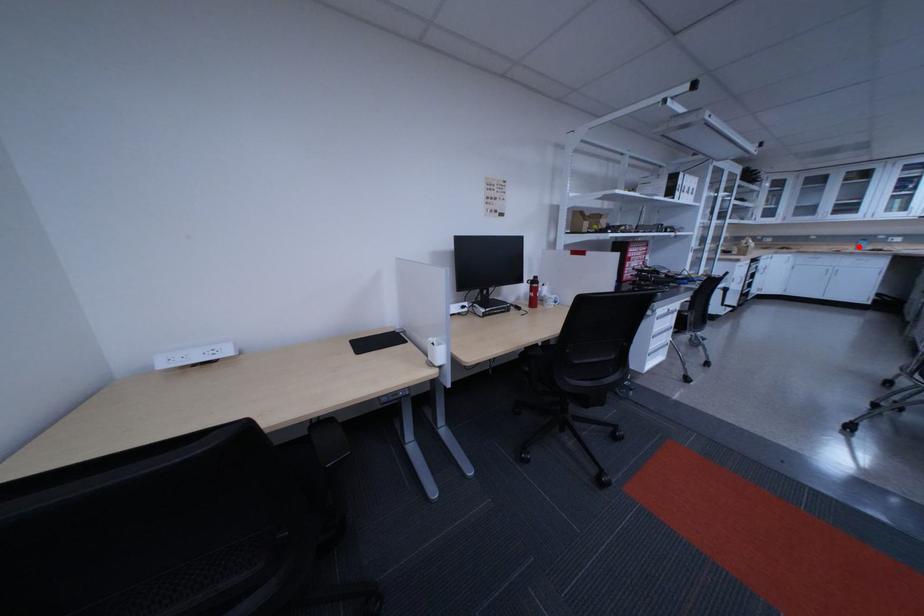
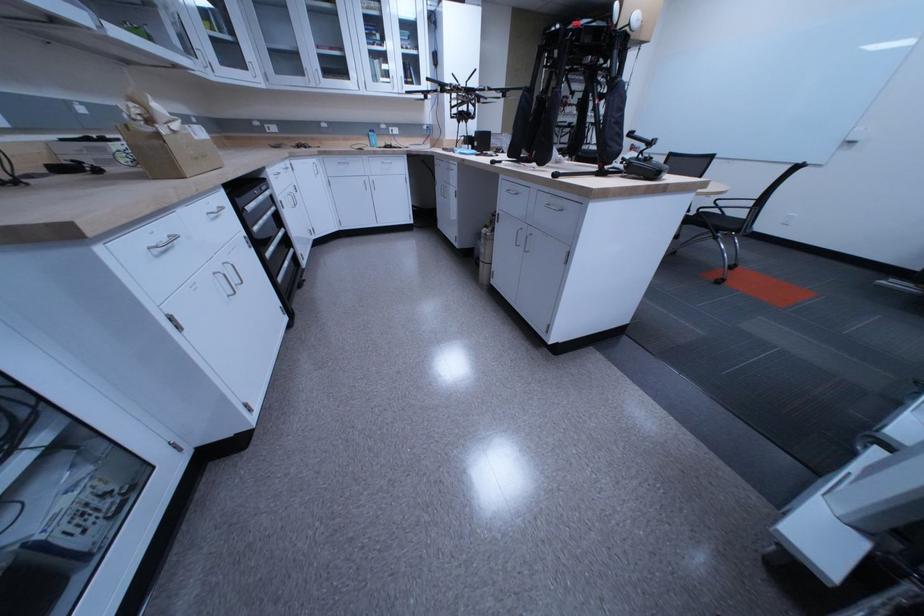
Question: A red point is marked in image1. In image2, is the corresponding 3D point closer to the camera or farther? Reply with the corresponding letter.

Choices:
 (A) The corresponding 3D point is closer.
 (B) The corresponding 3D point is farther.

Answer: (A)